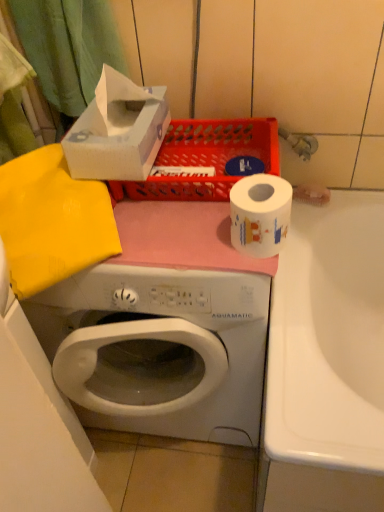
The width and height of the screenshot is (384, 512). In order to click on free space to the left of white glossy toilet paper at center in this screenshot , I will do `click(176, 240)`.